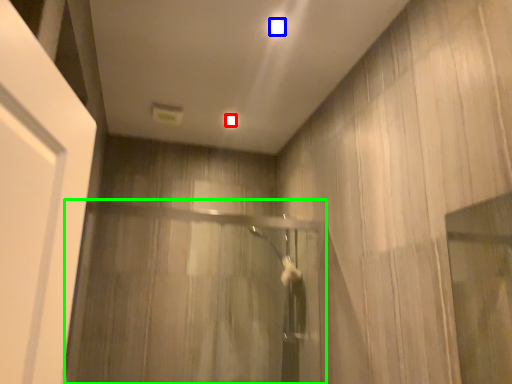
Question: Which object is the farthest from lighting (highlighted by a red box)? Choose among these: lighting (highlighted by a blue box) or screen door (highlighted by a green box).

Choices:
 (A) lighting
 (B) screen door

Answer: (B)